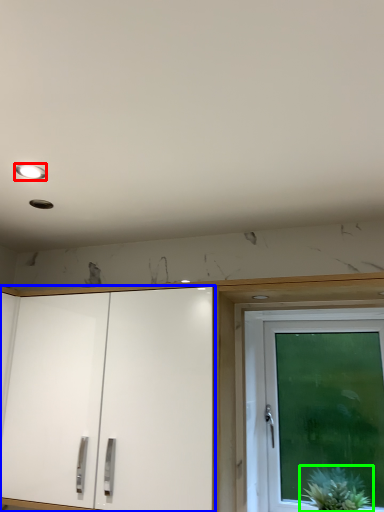
Question: Which is farther away from lighting (highlighted by a red box)? cabinetry (highlighted by a blue box) or houseplant (highlighted by a green box)?

Choices:
 (A) cabinetry
 (B) houseplant

Answer: (B)